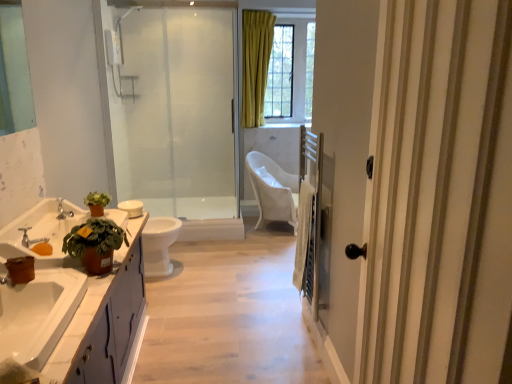
Locate an element on the screen. The image size is (512, 384). empty space that is to the right of white glossy toilet at center is located at coordinates (210, 268).